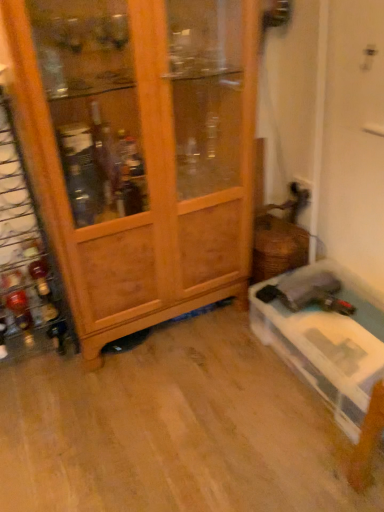
In order to click on free space in front of wooden cabinet at left in this screenshot , I will do `click(167, 411)`.